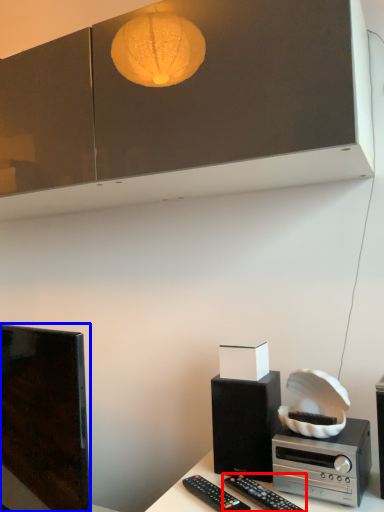
Question: Which point is closer to the camera, remote control (highlighted by a red box) or television (highlighted by a blue box)?

Choices:
 (A) remote control
 (B) television

Answer: (A)